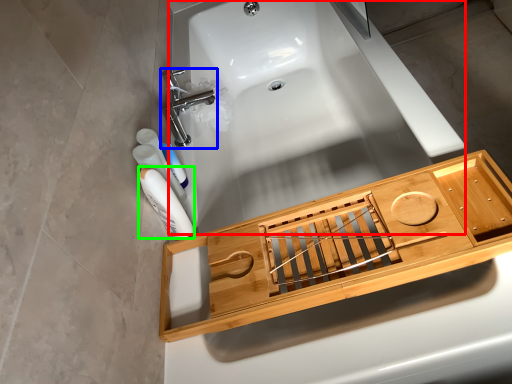
Question: Based on their relative distances, which object is nearer to bath (highlighted by a red box)? Choose from tap (highlighted by a blue box) and mouthwash (highlighted by a green box).

Choices:
 (A) tap
 (B) mouthwash

Answer: (A)